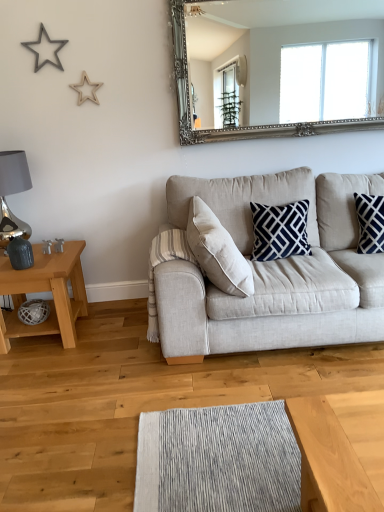
What is the approximate height of silver metallic lamp at left?

It is 25.79 inches.

In order to face silver metallic lamp at left, should I rotate leftwards or rightwards?

Turn left by 23.795 degrees to look at silver metallic lamp at left.

Find the location of a particular element. Image resolution: width=384 pixels, height=512 pixels. matte wooden table at left is located at coordinates (45, 290).

In the image, is beige fabric couch at center on the left side or the right side of matte wooden table at left?

beige fabric couch at center is positioned on matte wooden table at left's right side.

How different are the orientations of beige fabric couch at center and matte wooden table at left in degrees?

The angle between the facing direction of beige fabric couch at center and the facing direction of matte wooden table at left is 90.1 degrees.

Is point (302, 324) farther from viewer compared to point (19, 329)?

No, it is in front of (19, 329).

Is the position of silver metallic lamp at left more distant than that of beige fabric couch at center?

That is True.

Looking at this image, what's the angular difference between silver metallic lamp at left and beige fabric couch at center's facing directions?

silver metallic lamp at left and beige fabric couch at center are facing 47.7 degrees away from each other.

In terms of width, does silver metallic lamp at left look wider or thinner when compared to beige fabric couch at center?

Clearly, silver metallic lamp at left has less width compared to beige fabric couch at center.

Can you confirm if silver metallic lamp at left is smaller than beige fabric couch at center?

Yes, silver metallic lamp at left is smaller than beige fabric couch at center.

How different are the orientations of matte wooden table at left and beige fabric couch at center in degrees?

90.1 degrees separate the facing orientations of matte wooden table at left and beige fabric couch at center.

From the image's perspective, is matte wooden table at left above beige fabric couch at center?

No, from the image's perspective, matte wooden table at left is not on top of beige fabric couch at center.

Which object is further away from the camera taking this photo, matte wooden table at left or beige fabric couch at center?

matte wooden table at left is further away from the camera.

Considering the positions of point (60, 260) and point (305, 168), is point (60, 260) closer or farther from the camera than point (305, 168)?

Point (60, 260) is closer to the camera than point (305, 168).

Is silver ornate mirror at upper center placed right next to silver metallic lamp at left?

No, silver ornate mirror at upper center is not with silver metallic lamp at left.

Does silver ornate mirror at upper center have a greater width compared to silver metallic lamp at left?

No.

Consider the image. Would you consider silver metallic lamp at left to be distant from silver ornate mirror at upper center?

Yes, silver metallic lamp at left is far from silver ornate mirror at upper center.

Between silver metallic lamp at left and silver ornate mirror at upper center, which one has less height?

Standing shorter between the two is silver metallic lamp at left.

Which point is more distant from viewer, (x=21, y=224) or (x=214, y=5)?

The point (x=214, y=5) is farther from the camera.

How far apart are beige fabric couch at center and silver metallic lamp at left?

beige fabric couch at center and silver metallic lamp at left are 4.56 feet apart from each other.

Between point (318, 283) and point (21, 162), which one is positioned behind?

The point (21, 162) is farther from the camera.

Does beige fabric couch at center lie behind silver metallic lamp at left?

That is False.

From a real-world perspective, does beige fabric couch at center sit lower than silver metallic lamp at left?

Yes.

Is beige fabric couch at center next to silver ornate mirror at upper center and touching it?

No, beige fabric couch at center is not touching silver ornate mirror at upper center.

At what (x,y) coordinates should I click in order to perform the action: click on mirror positioned vertically above the beige fabric couch at center (from a real-world perspective). Please return your answer as a coordinate pair (x, y). The width and height of the screenshot is (384, 512). Looking at the image, I should click on (275, 44).

Could silver ornate mirror at upper center be considered to be inside beige fabric couch at center?

No.

Can you confirm if beige fabric couch at center is smaller than silver ornate mirror at upper center?

No.

Find the location of a particular element. Image resolution: width=384 pixels, height=512 pixels. table on the left of beige fabric couch at center is located at coordinates [x=45, y=290].

In the image, there is a silver metallic lamp at left. Where is `studio couch below it (from a real-world perspective)`? This screenshot has width=384, height=512. studio couch below it (from a real-world perspective) is located at coordinates (273, 271).

Looking at the image, which one is located further to beige fabric couch at center, silver ornate mirror at upper center or matte wooden table at left?

silver ornate mirror at upper center lies further to beige fabric couch at center than the other object.

Based on their spatial positions, is silver ornate mirror at upper center or silver metallic lamp at left further from matte wooden table at left?

silver ornate mirror at upper center is positioned further to the anchor matte wooden table at left.

Which object lies nearer to the anchor point silver metallic lamp at left, beige fabric couch at center or matte wooden table at left?

Among the two, matte wooden table at left is located nearer to silver metallic lamp at left.

From the image, which object appears to be nearer to silver ornate mirror at upper center, silver metallic lamp at left or beige fabric couch at center?

Based on the image, beige fabric couch at center appears to be nearer to silver ornate mirror at upper center.

Based on their spatial positions, is silver ornate mirror at upper center or beige fabric couch at center further from matte wooden table at left?

Based on the image, silver ornate mirror at upper center appears to be further to matte wooden table at left.

Looking at the image, which one is located further to silver metallic lamp at left, silver ornate mirror at upper center or beige fabric couch at center?

Among the two, silver ornate mirror at upper center is located further to silver metallic lamp at left.

Based on their spatial positions, is matte wooden table at left or silver metallic lamp at left closer to silver ornate mirror at upper center?

Among the two, matte wooden table at left is located nearer to silver ornate mirror at upper center.

When comparing their distances from matte wooden table at left, does silver metallic lamp at left or silver ornate mirror at upper center seem closer?

silver metallic lamp at left is closer to matte wooden table at left.

Locate an element on the screen. The height and width of the screenshot is (512, 384). mirror between silver metallic lamp at left and beige fabric couch at center is located at coordinates (275, 44).

The image size is (384, 512). What are the coordinates of `table between silver metallic lamp at left and beige fabric couch at center in the horizontal direction` in the screenshot? It's located at (45, 290).

Find the location of a particular element. Image resolution: width=384 pixels, height=512 pixels. mirror between matte wooden table at left and beige fabric couch at center in the horizontal direction is located at coordinates (275, 44).

Where is `table between silver metallic lamp at left and silver ornate mirror at upper center`? table between silver metallic lamp at left and silver ornate mirror at upper center is located at coordinates (45, 290).